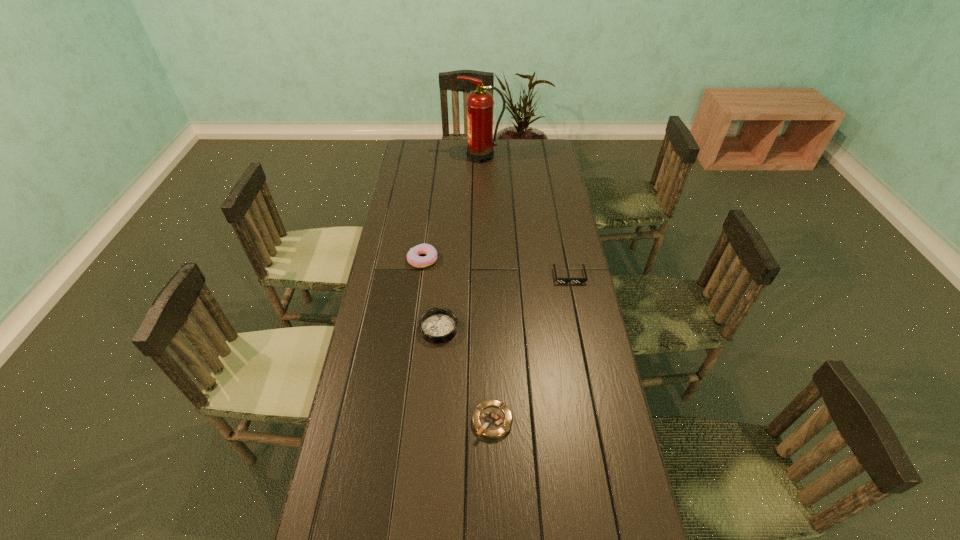
Where is `vacant region at the right edge`? Image resolution: width=960 pixels, height=540 pixels. vacant region at the right edge is located at coordinates (560, 256).

Identify the location of empty space that is in between the tallest object and the farther ashtray. The image size is (960, 540). (461, 242).

You are a GUI agent. You are given a task and a screenshot of the screen. Output one action in this format:
    pyautogui.click(x=<x>, y=<y>)
    Task: Click on the vacant area between the left ashtray and the right ashtray
    Image resolution: width=960 pixels, height=540 pixels.
    Given the screenshot: What is the action you would take?
    pyautogui.click(x=466, y=375)

Locate an element on the screen. The image size is (960, 540). vacant space that is in between the nearer ashtray and the fourth shortest object is located at coordinates (457, 340).

You are a GUI agent. You are given a task and a screenshot of the screen. Output one action in this format:
    pyautogui.click(x=<x>, y=<y>)
    Task: Click on the vacant area that lies between the sunglasses and the farthest object
    The image size is (960, 540).
    Given the screenshot: What is the action you would take?
    pyautogui.click(x=525, y=216)

The width and height of the screenshot is (960, 540). I want to click on object that stands as the third closest to the doughnut, so click(491, 419).

Find the location of `the fourth closest object to the sunglasses`. the fourth closest object to the sunglasses is located at coordinates (481, 141).

Locate an element on the screen. ashtray that is the closest one to the fourth shortest object is located at coordinates (437, 325).

This screenshot has height=540, width=960. In order to click on vacant space that satisfies the following two spatial constraints: 1. on the front-facing side of the farthest object; 2. on the front side of the doughnut in this screenshot , I will do `click(482, 259)`.

Where is `free spot that satisfies the following two spatial constraints: 1. on the front side of the nearest object; 2. on the left side of the farther ashtray`? The width and height of the screenshot is (960, 540). free spot that satisfies the following two spatial constraints: 1. on the front side of the nearest object; 2. on the left side of the farther ashtray is located at coordinates (431, 421).